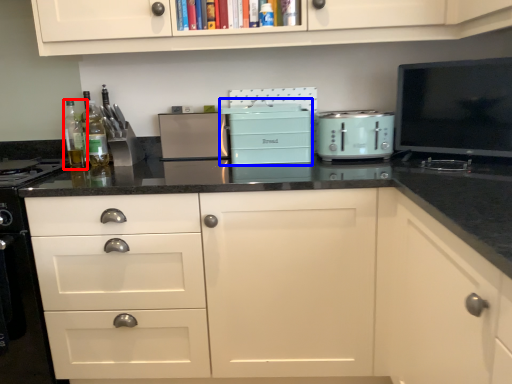
Question: Which object is closer to the camera taking this photo, bottle (highlighted by a red box) or appliance (highlighted by a blue box)?

Choices:
 (A) bottle
 (B) appliance

Answer: (B)